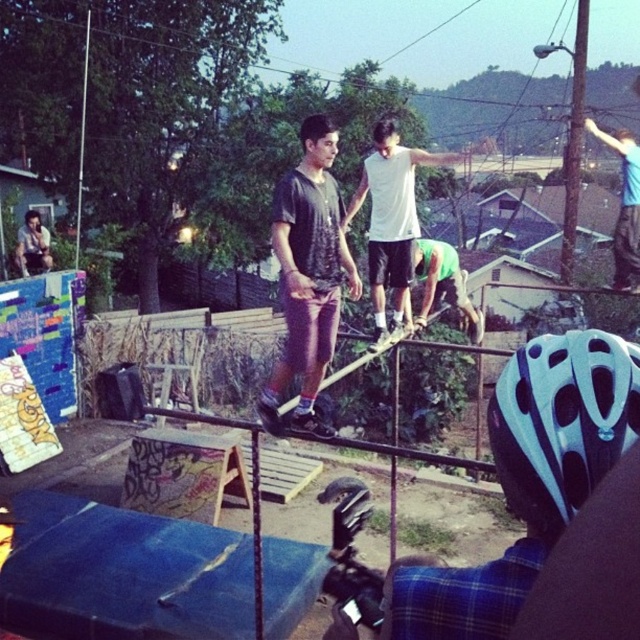
Question: Is blue matte bicycle helmet at center-right positioned at the back of matte black shirt at center?

Choices:
 (A) yes
 (B) no

Answer: (B)

Question: Estimate the real-world distances between objects in this image. Which object is closer to the white matte shirt at center?

Choices:
 (A) blue matte bicycle helmet at center-right
 (B) matte black shirt at center

Answer: (B)

Question: Which of these objects is positioned farthest from the matte black shirt at center?

Choices:
 (A) green matte shirt at center
 (B) blue matte bicycle helmet at center-right

Answer: (B)

Question: Is blue matte bicycle helmet at center-right to the right of matte black shirt at center from the viewer's perspective?

Choices:
 (A) yes
 (B) no

Answer: (A)

Question: Is the position of matte black shirt at center less distant than that of white matte shirt at center?

Choices:
 (A) no
 (B) yes

Answer: (B)

Question: Which of the following is the closest to the observer?

Choices:
 (A) green matte shirt at center
 (B) white matte shirt at center
 (C) blue matte bicycle helmet at center-right
 (D) matte black shirt at center

Answer: (C)